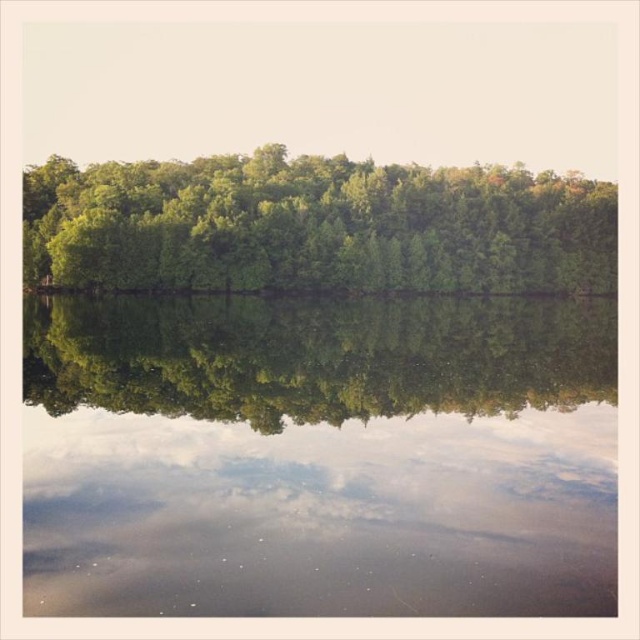
Question: Can you confirm if transparent water at center is bigger than green leafy trees at center?

Choices:
 (A) no
 (B) yes

Answer: (A)

Question: Is transparent water at center to the right of green leafy trees at center from the viewer's perspective?

Choices:
 (A) yes
 (B) no

Answer: (B)

Question: Which object appears farthest from the camera in this image?

Choices:
 (A) green leafy trees at center
 (B) transparent water at center

Answer: (A)

Question: Among these points, which one is farthest from the camera?

Choices:
 (A) (72, 170)
 (B) (337, 390)

Answer: (A)

Question: Among these points, which one is farthest from the camera?

Choices:
 (A) (532, 282)
 (B) (532, 365)

Answer: (A)

Question: Does transparent water at center come behind green leafy trees at center?

Choices:
 (A) yes
 (B) no

Answer: (B)